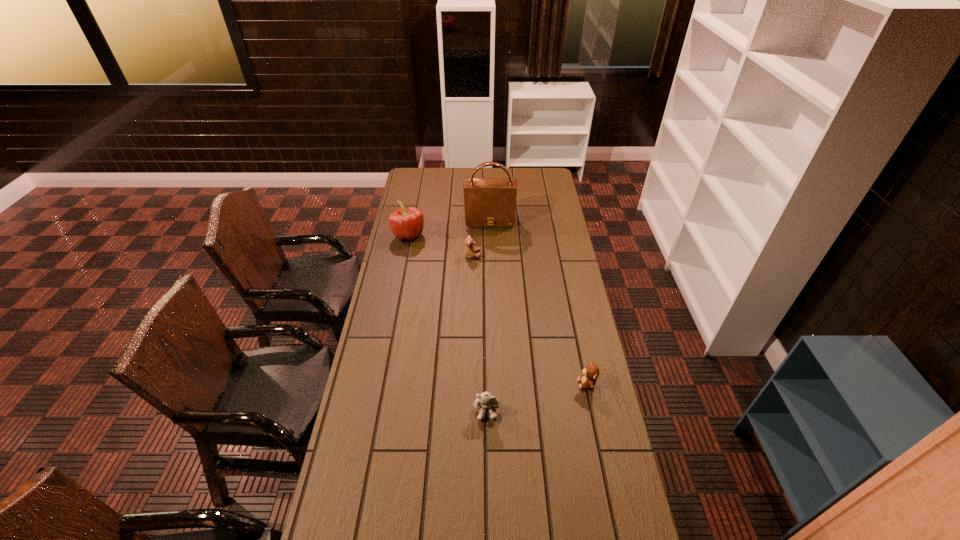
Find the location of a particular element. The width and height of the screenshot is (960, 540). free spot between the rightmost teddy bear and the nearest object is located at coordinates (537, 396).

This screenshot has width=960, height=540. I want to click on unoccupied position between the second nearest object and the nearest teddy bear, so click(537, 396).

Locate an element on the screen. The height and width of the screenshot is (540, 960). unoccupied position between the shoulder bag and the fourth farthest object is located at coordinates (539, 302).

Locate which object ranks second in proximity to the second tallest object. Please provide its 2D coordinates. Your answer should be formatted as a tuple, i.e. [(x, y)], where the tuple contains the x and y coordinates of a point satisfying the conditions above.

[(470, 250)]

This screenshot has height=540, width=960. I want to click on object that is the second closest to the nearest teddy bear, so click(470, 250).

Select which teddy bear appears as the second closest to the second nearest object. Please provide its 2D coordinates. Your answer should be formatted as a tuple, i.e. [(x, y)], where the tuple contains the x and y coordinates of a point satisfying the conditions above.

[(470, 250)]

Image resolution: width=960 pixels, height=540 pixels. In order to click on teddy bear that stands as the closest to the farthest teddy bear in this screenshot , I will do `click(590, 374)`.

In order to click on free space that satisfies the following two spatial constraints: 1. on the face of the second farthest teddy bear; 2. on the face of the nearest object in this screenshot , I will do `click(592, 409)`.

I want to click on blank space that satisfies the following two spatial constraints: 1. on the front flap of the tallest object; 2. on the front-facing side of the third nearest object, so click(491, 255).

Locate an element on the screen. This screenshot has width=960, height=540. vacant space that satisfies the following two spatial constraints: 1. on the front flap of the shoulder bag; 2. on the front-facing side of the farthest teddy bear is located at coordinates tap(491, 255).